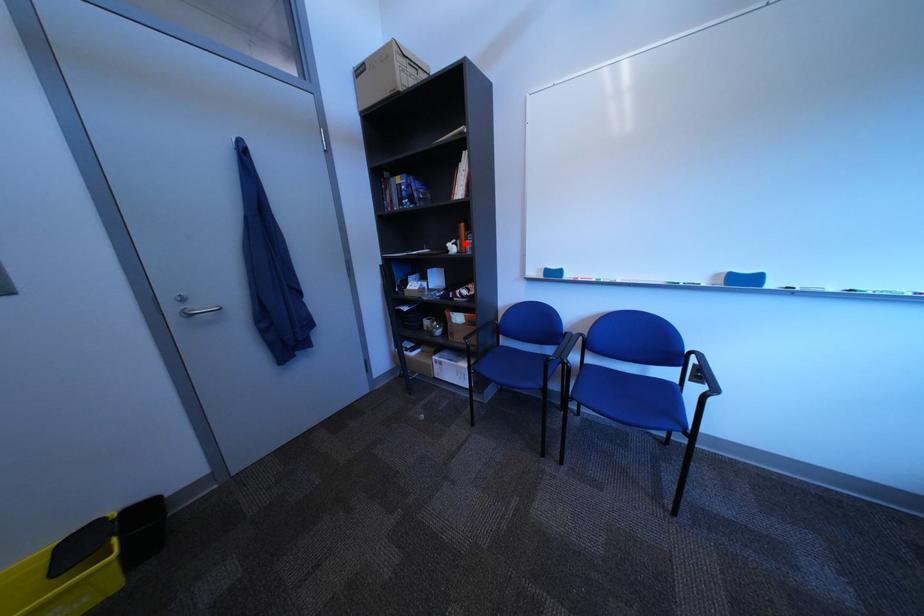
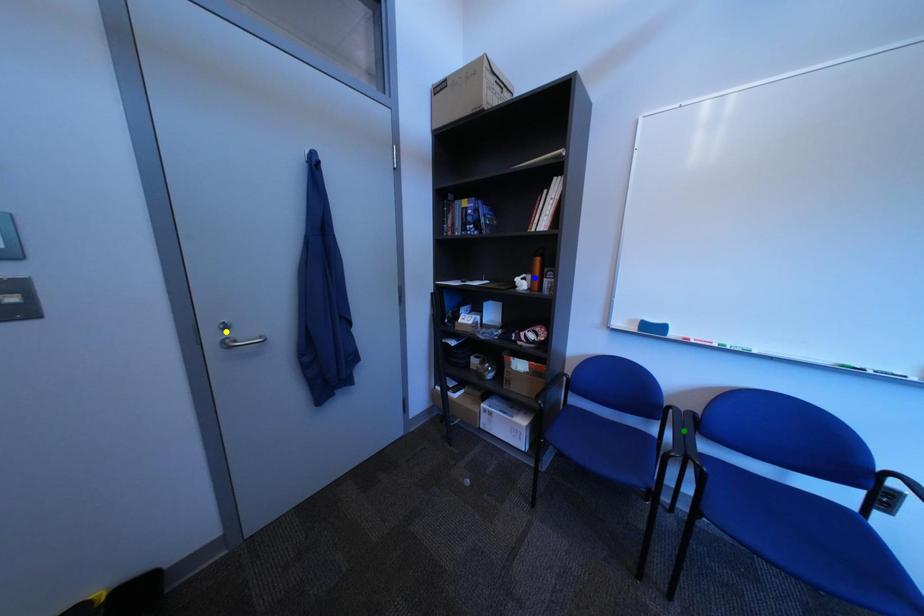
Question: I am providing you with two images of the same scene from different viewpoints. A red point is marked on the first image. You are given multiple points on the second image. Can you choose the point in image 2 that corresponds to the point in image 1?

Choices:
 (A) green point
 (B) yellow point
 (C) blue point

Answer: (C)